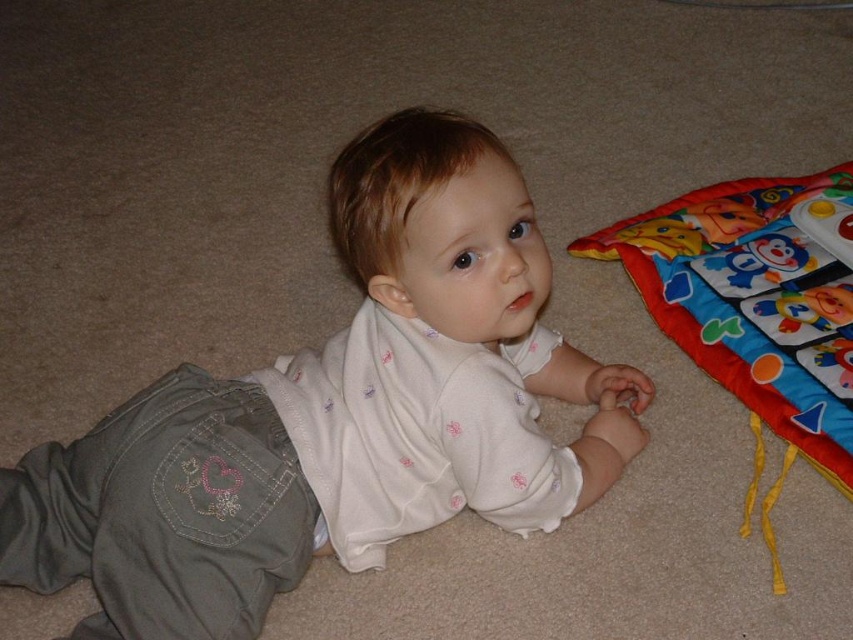
Consider the image. You are a photographer taking a picture of the child lying on the carpeted floor. You notice two points in the image labeled as point (107, 490) and point (750, 204). Which point should you focus on to ensure the child is in sharp focus?

You should focus on point (107, 490) because it is closer to the camera than point (750, 204), ensuring the child is in sharp focus.

You are a parent trying to move the white soft baby at center to the other side of the room. However, you need to ensure that the baby stays away from the colorful fabric play mat at lower right. Based on the scene, can you confirm if moving the baby directly forward from its current position would place it closer to or farther from the play mat?

The white soft baby at center is in front of the colorful fabric play mat at lower right. Moving the baby directly forward would place it farther away from the play mat, so it would stay away as desired.